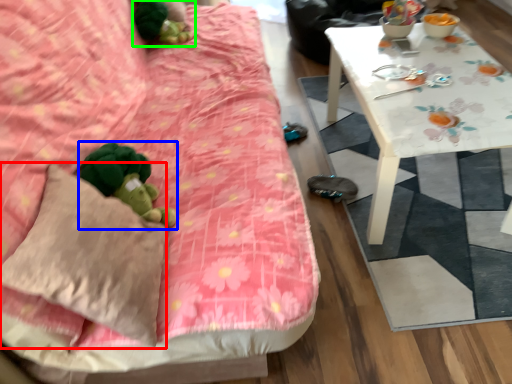
Question: Considering the real-world distances, which object is farthest from throw pillow (highlighted by a red box)? toy (highlighted by a blue box) or miniature (highlighted by a green box)?

Choices:
 (A) toy
 (B) miniature

Answer: (B)